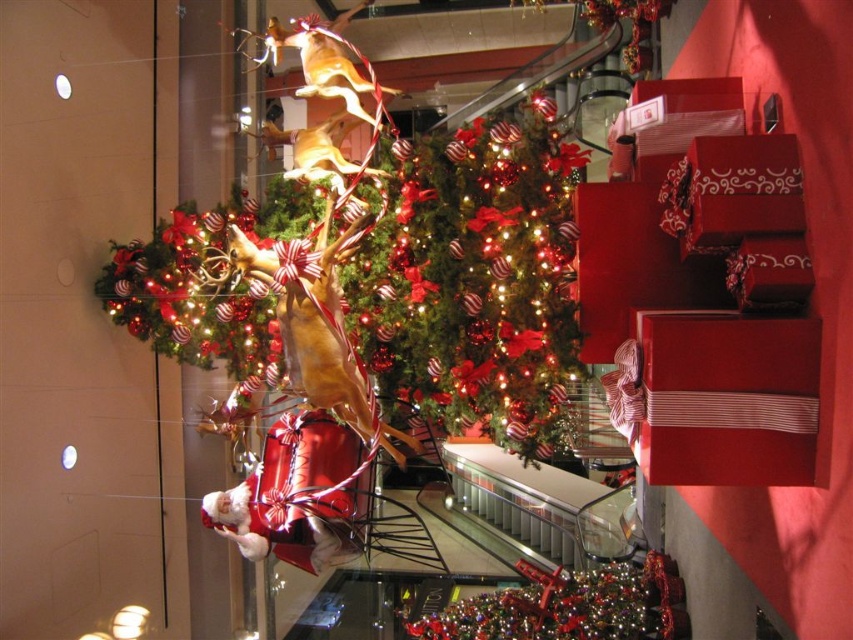
Does shiny red gift at center have a smaller size compared to shiny metallic ornament at center?

Actually, shiny red gift at center might be larger than shiny metallic ornament at center.

Between point (483, 392) and point (543, 600), which one is positioned in front?

Positioned in front is point (483, 392).

Who is more distant from viewer, (x=410, y=326) or (x=525, y=620)?

Point (x=525, y=620)

Identify the location of shiny red gift at center. [x=474, y=278].

Between shiny red gift at center and shiny red christmas tree at center, which one has less height?

Standing shorter between the two is shiny red gift at center.

Locate an element on the screen. shiny red gift at center is located at coordinates (474, 278).

The height and width of the screenshot is (640, 853). Identify the location of shiny red gift at center. (474, 278).

Is point (444, 417) farther from viewer compared to point (469, 621)?

No, (444, 417) is closer to viewer.

Does shiny red christmas tree at center appear over shiny metallic ornament at center?

Correct, shiny red christmas tree at center is located above shiny metallic ornament at center.

Measure the distance between point (517, 145) and camera.

They are 9.71 feet apart.

At what (x,y) coordinates should I click in order to perform the action: click on shiny red christmas tree at center. Please return your answer as a coordinate pair (x, y). The width and height of the screenshot is (853, 640). Looking at the image, I should click on (477, 280).